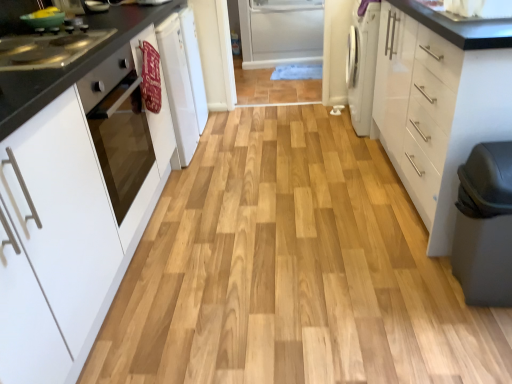
Question: From the image's perspective, does stainless steel stove at left appear lower than white matte cabinet at left, which is counted as the 1th cabinetry, starting from the left?

Choices:
 (A) no
 (B) yes

Answer: (A)

Question: From a real-world perspective, is stainless steel stove at left positioned under white matte cabinet at left, which appears as the second cabinetry when viewed from the right, based on gravity?

Choices:
 (A) no
 (B) yes

Answer: (A)

Question: Does stainless steel stove at left turn towards white matte cabinet at left, which appears as the second cabinetry when viewed from the right?

Choices:
 (A) yes
 (B) no

Answer: (A)

Question: Can you confirm if stainless steel stove at left is smaller than white matte cabinet at left, which is counted as the 1th cabinetry, starting from the left?

Choices:
 (A) yes
 (B) no

Answer: (A)

Question: Would you say stainless steel stove at left contains white matte cabinet at left, which is counted as the 1th cabinetry, starting from the left?

Choices:
 (A) yes
 (B) no

Answer: (B)

Question: Is stainless steel stove at left positioned behind white matte cabinet at left, which appears as the second cabinetry when viewed from the right?

Choices:
 (A) yes
 (B) no

Answer: (A)

Question: Considering the relative sizes of matte gray step stool at lower right and white glossy cabinet at right, positioned as the second cabinetry in left-to-right order, in the image provided, is matte gray step stool at lower right shorter than white glossy cabinet at right, positioned as the second cabinetry in left-to-right order,?

Choices:
 (A) no
 (B) yes

Answer: (B)

Question: Is matte gray step stool at lower right taller than white glossy cabinet at right, positioned as the second cabinetry in left-to-right order?

Choices:
 (A) yes
 (B) no

Answer: (B)

Question: Is matte gray step stool at lower right at the left side of white glossy cabinet at right, positioned as the second cabinetry in left-to-right order?

Choices:
 (A) yes
 (B) no

Answer: (A)

Question: From the image's perspective, is matte gray step stool at lower right under white glossy cabinet at right, positioned as the second cabinetry in left-to-right order?

Choices:
 (A) yes
 (B) no

Answer: (A)

Question: Is matte gray step stool at lower right wider than white glossy cabinet at right, positioned as the second cabinetry in left-to-right order?

Choices:
 (A) no
 (B) yes

Answer: (A)

Question: Is matte gray step stool at lower right bigger than white glossy cabinet at right, positioned as the 1th cabinetry in right-to-left order?

Choices:
 (A) no
 (B) yes

Answer: (A)

Question: Can you confirm if white matte cabinet at left, which appears as the second cabinetry when viewed from the right, is taller than white glossy oven at left?

Choices:
 (A) yes
 (B) no

Answer: (A)